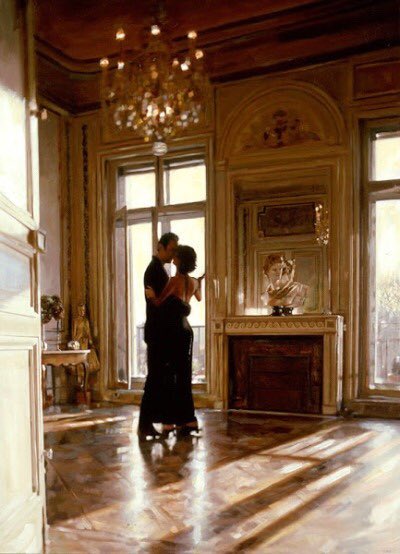
Find the location of a particular element. wooden floor is located at coordinates (235, 146), (153, 473).